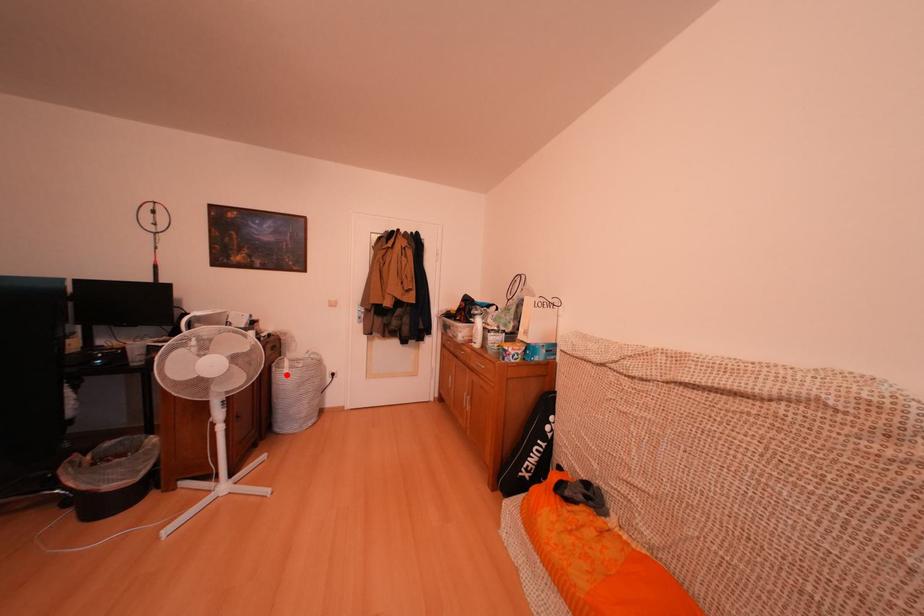
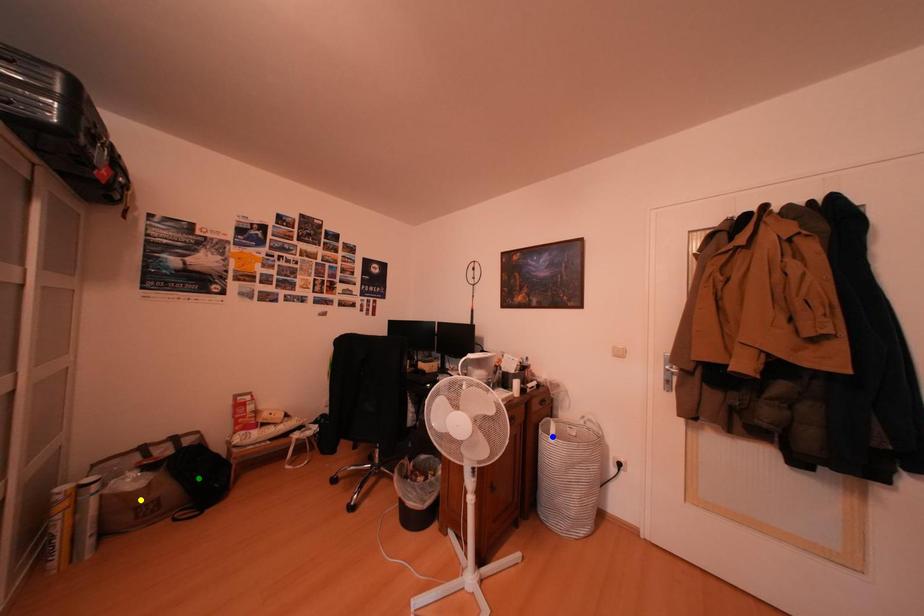
Question: I am providing you with two images of the same scene from different viewpoints. A red point is marked on the first image. You are given multiple points on the second image. Which spot in image 2 lines up with the point in image 1?

Choices:
 (A) blue point
 (B) green point
 (C) yellow point

Answer: (A)